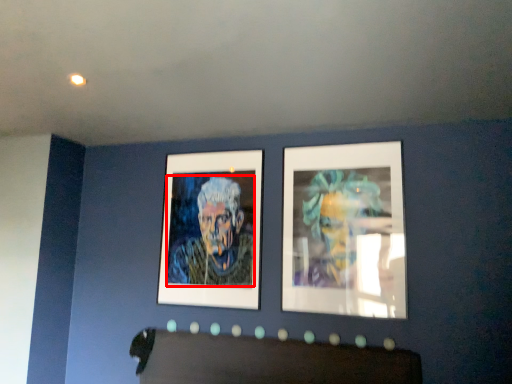
Question: From the image's perspective, where is person (annotated by the red box) located relative to picture frame?

Choices:
 (A) below
 (B) above

Answer: (A)